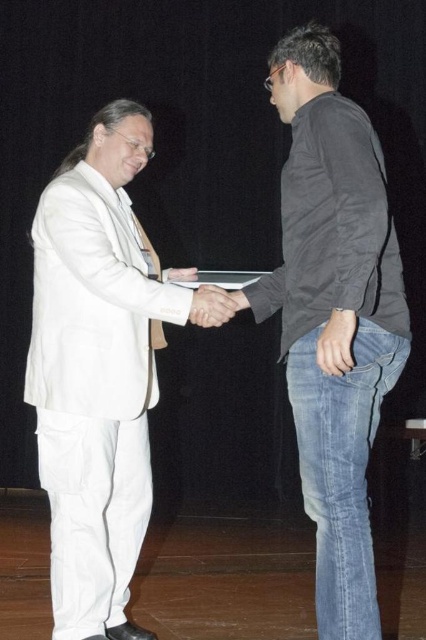
You are standing in front of the stage where the handshake is happening. There is a point marked at coordinates (x=97, y=371). Which object at the scene is located at that point?

The point at coordinates (x=97, y=371) corresponds to the white matte suit at left.

You are an event photographer positioned behind the stage. You need to capture a photo where both the white matte suit at left and the matte black hand at center are clearly visible. Based on their positions, which object should you ensure is not blocking the other?

The white matte suit at left is to the left of the matte black hand at center. Therefore, you should ensure that the matte black hand at center does not block the white matte suit at left when positioning your shot.

You are standing in front of the stage where the handshake is happening. There are two points marked in the image. Point A is at coordinates point [377,237] and Point B is at point [207,326]. Which point is closer to you?

Point A at coordinates point [377,237] is closer to the viewer than point B at point [207,326].